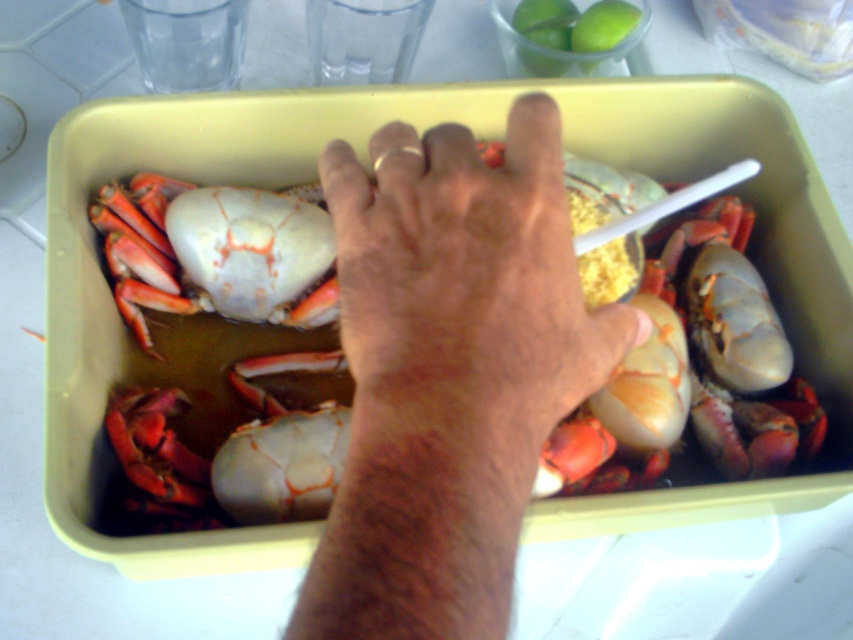
Question: Can you confirm if dry skin hand at center is positioned to the right of smooth orange crab at center?

Choices:
 (A) no
 (B) yes

Answer: (B)

Question: Which object is farther from the camera taking this photo?

Choices:
 (A) dry skin hand at center
 (B) smooth orange crab at center

Answer: (B)

Question: Does dry skin hand at center lie in front of smooth orange crab at center?

Choices:
 (A) no
 (B) yes

Answer: (B)

Question: Can you confirm if dry skin hand at center is wider than smooth orange crab at center?

Choices:
 (A) no
 (B) yes

Answer: (B)

Question: Which of the following is the farthest from the observer?

Choices:
 (A) (444, 406)
 (B) (277, 321)

Answer: (B)